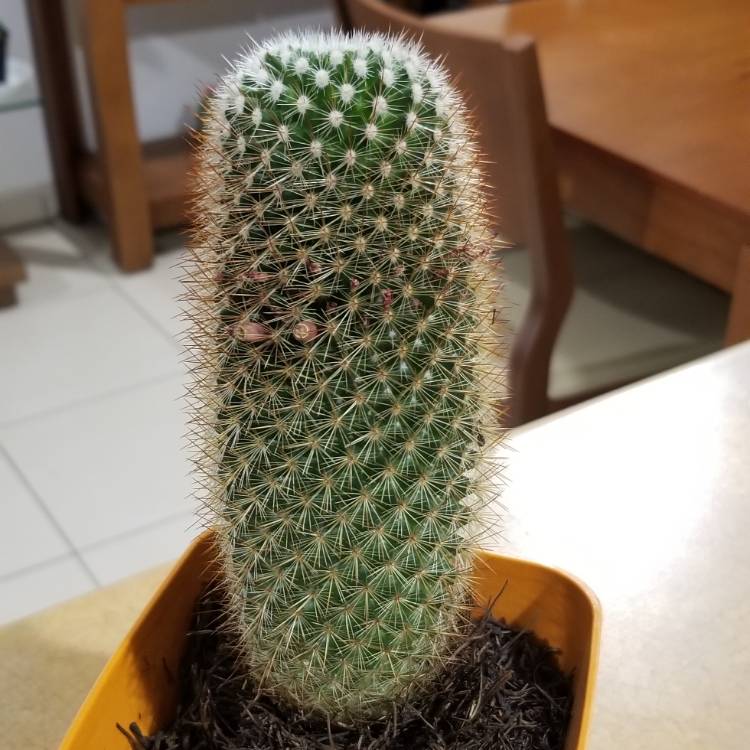
What are the coordinates of `chair` in the screenshot? It's located at (512, 94).